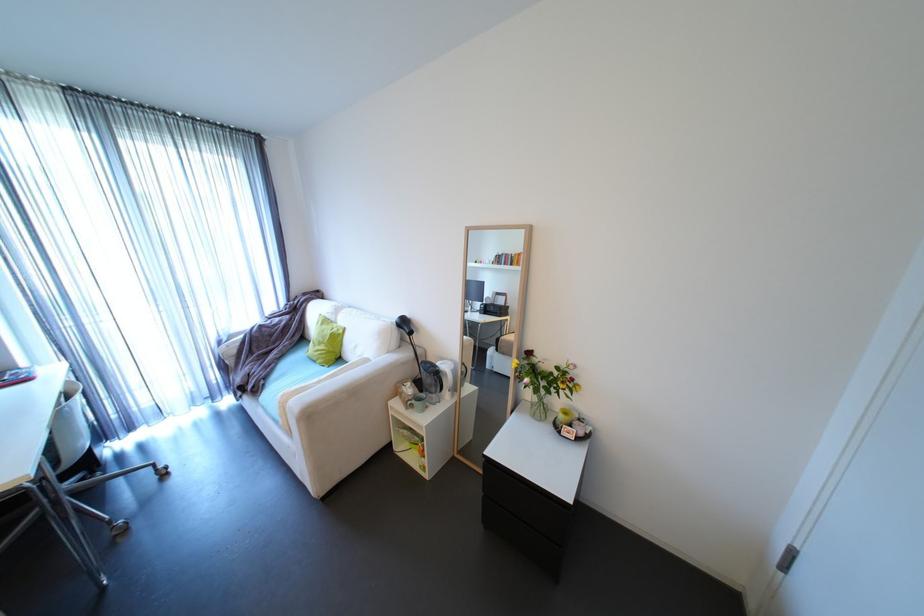
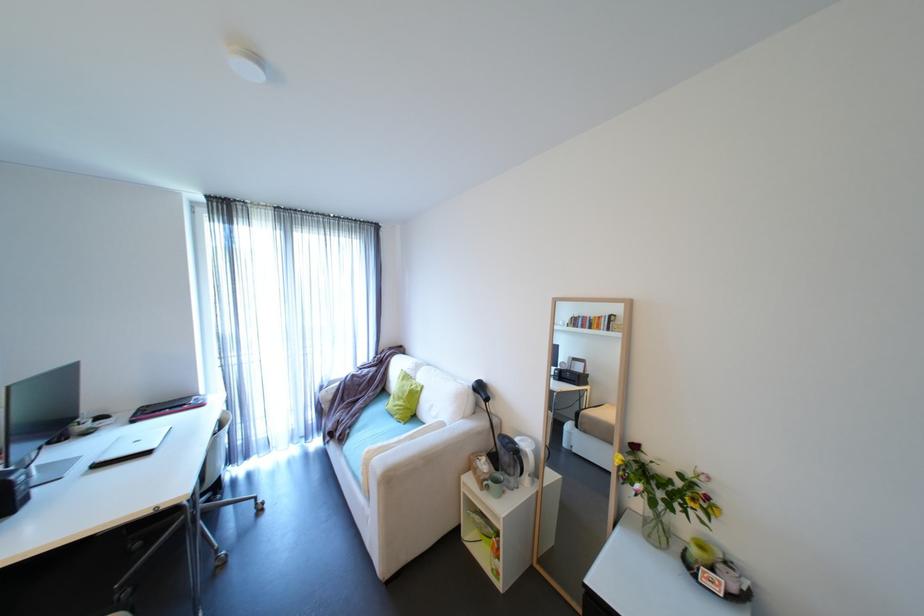
Find the pixel in the second image that matches (x=447, y=363) in the first image.

(527, 440)